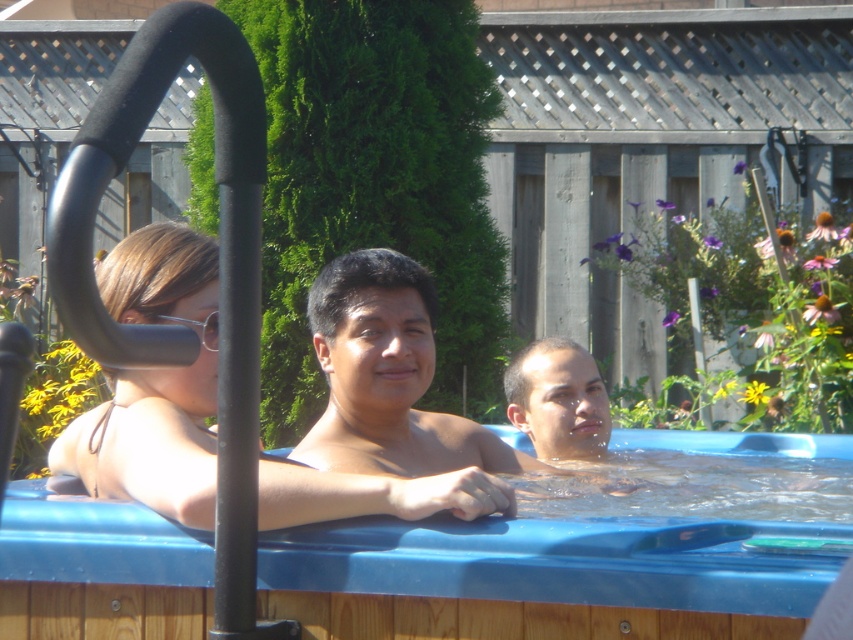
Does matte black bikini top at center have a smaller size compared to smooth skin man at center?

Actually, matte black bikini top at center might be larger than smooth skin man at center.

Does point (158, 492) lie behind point (393, 326)?

No, (158, 492) is in front of (393, 326).

Which is in front, point (480, 509) or point (537, 461)?

Point (480, 509) is more forward.

Locate an element on the screen. matte black bikini top at center is located at coordinates (154, 384).

Who is taller, blue plastic hot tub at center or matte black bikini top at center?

matte black bikini top at center is taller.

I want to click on blue plastic hot tub at center, so click(544, 577).

The width and height of the screenshot is (853, 640). Describe the element at coordinates (544, 577) in the screenshot. I see `blue plastic hot tub at center` at that location.

Between blue plastic hot tub at center and smooth skin man at center, which one has more height?

smooth skin man at center

Who is more distant from viewer, [0,536] or [399,316]?

Point [399,316]

At what (x,y) coordinates should I click in order to perform the action: click on blue plastic hot tub at center. Please return your answer as a coordinate pair (x, y). The height and width of the screenshot is (640, 853). Looking at the image, I should click on (544, 577).